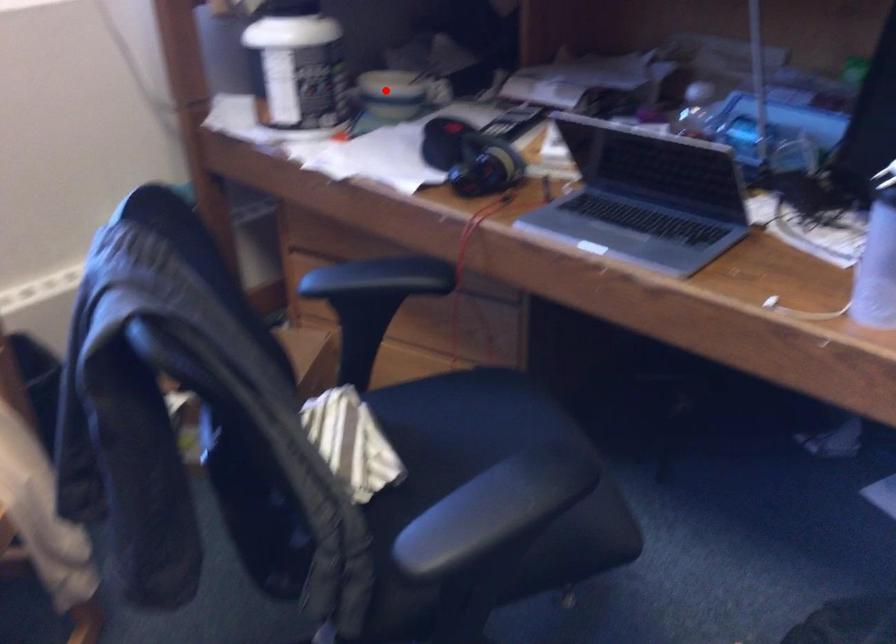
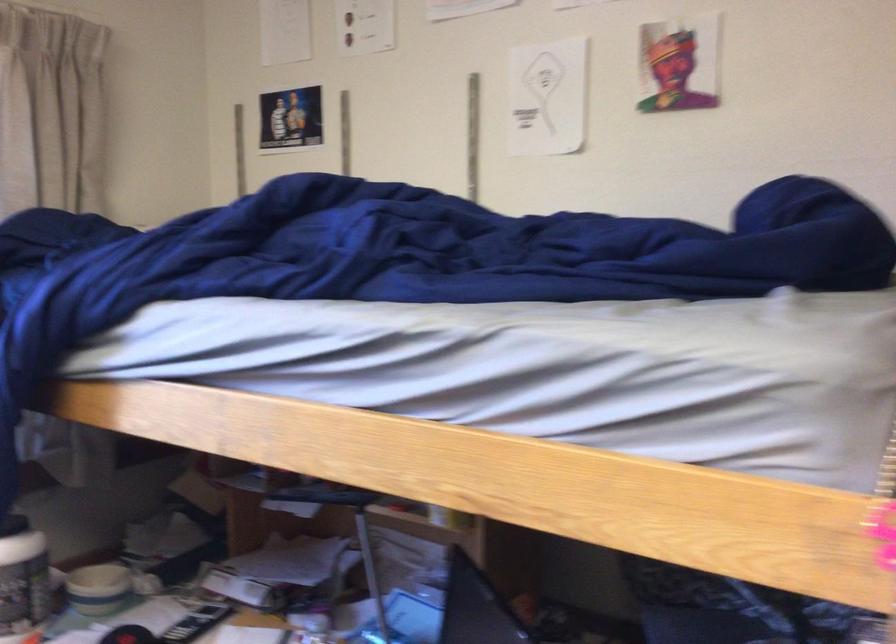
The point at the highlighted location is marked in the first image. Where is the corresponding point in the second image?

(98, 589)